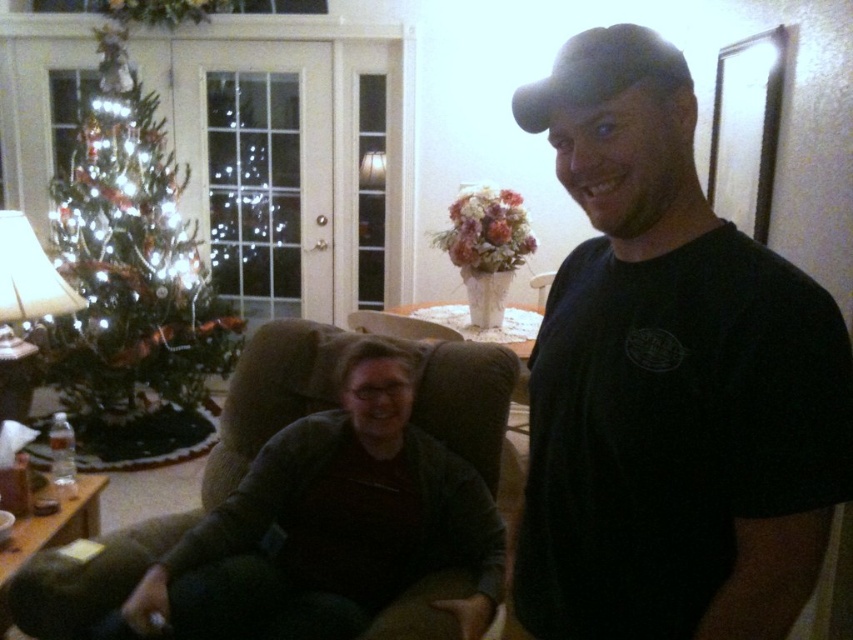
From the picture: Between black matte t-shirt at center and brown fabric couch at lower left, which one has more height?

With more height is black matte t-shirt at center.

Does black matte t-shirt at center appear over brown fabric couch at lower left?

Yes.

Is point (828, 400) positioned behind point (480, 458)?

No, (828, 400) is closer to viewer.

What are the coordinates of `black matte t-shirt at center` in the screenshot? It's located at (669, 380).

Consider the image. Is the position of black matte t-shirt at center more distant than that of green matte christmas tree at left?

No.

Between black matte t-shirt at center and green matte christmas tree at left, which one is positioned higher?

green matte christmas tree at left is higher up.

Between point (598, 566) and point (83, 438), which one is positioned in front?

Positioned in front is point (598, 566).

Image resolution: width=853 pixels, height=640 pixels. I want to click on black matte t-shirt at center, so click(x=669, y=380).

Can you confirm if green matte christmas tree at left is shorter than brown fabric couch at lower left?

No.

Is point (161, 4) positioned after point (428, 353)?

Yes, it is behind point (428, 353).

Is point (224, 332) positioned behind point (96, 564)?

Yes, point (224, 332) is behind point (96, 564).

At what (x,y) coordinates should I click in order to perform the action: click on green matte christmas tree at left. Please return your answer as a coordinate pair (x, y). Looking at the image, I should click on (132, 257).